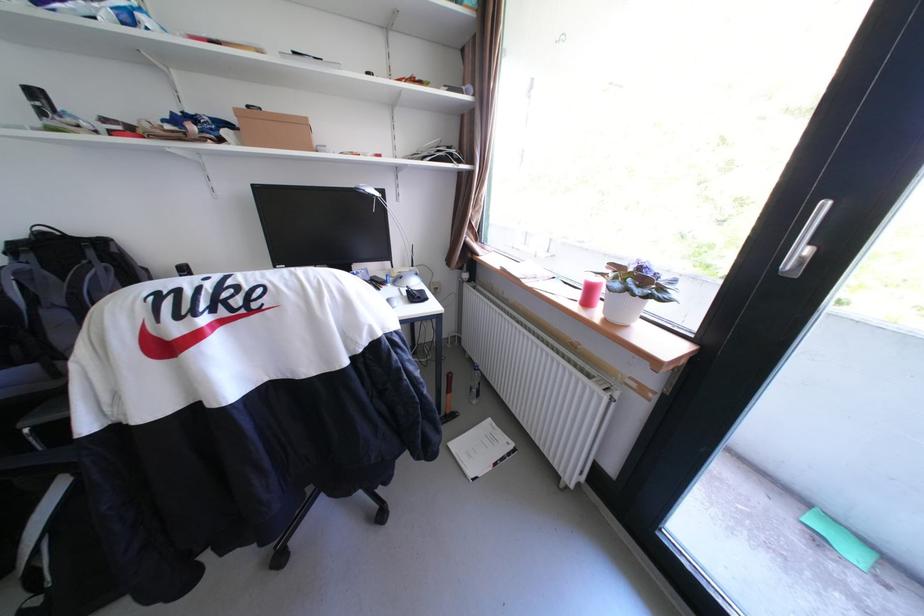
What do you see at coordinates (371, 195) in the screenshot? I see `the desk lamp head` at bounding box center [371, 195].